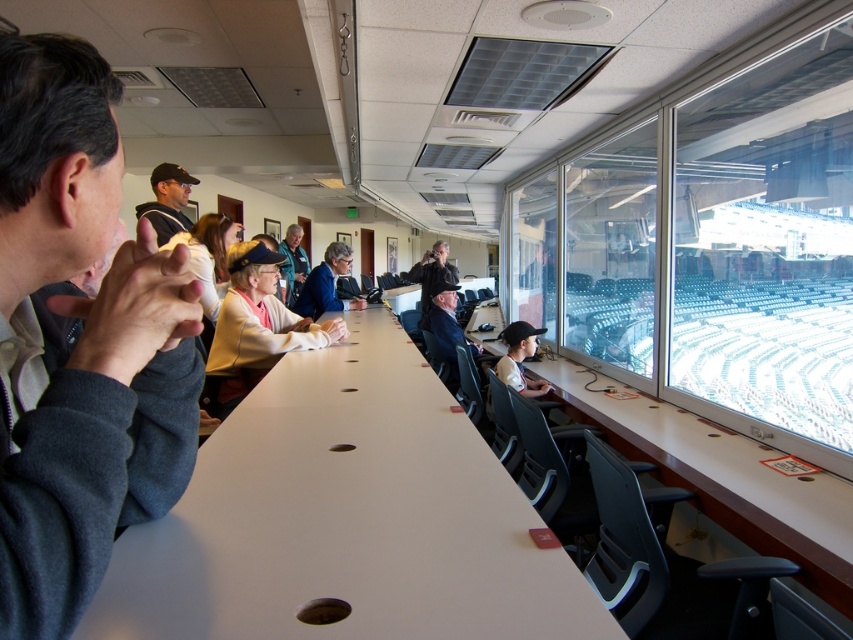
You are organizing a photo shoot and need to ensure that the matte blue jacket at center and the light brown leather jacket at center can fit side by side on a display rack that is 1.2 meters wide. Based on the image, can both jackets fit without overlapping?

The matte blue jacket at center might be wider than light brown leather jacket at center. Since the exact width isn t specified, it s possible that together they could exceed the 1.2 meter rack width. To be certain, measure both jackets first.

You are a photographer in the press box and need to place a camera on the table. The camera requires a flat surface area of 30 cm by 30 cm. Given the white laminate table at right and the matte black cap at upper center, which object can accommodate the camera?

The white laminate table at right is larger in size than the matte black cap at upper center, so the camera can be placed on the white laminate table at right as it has sufficient space.

In the scene shown: You are organizing a meeting in the press box and need to place a white fabric jacket at center on the white matte table at center. Will the jacket fit entirely on the table without hanging over the edges?

The white matte table at center has a smaller size compared to white fabric jacket at center, so the jacket will not fit entirely on the table and will hang over the edges.